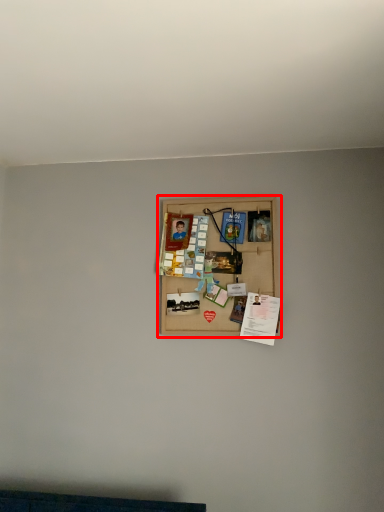
Question: From the image's perspective, where is picture frame (annotated by the red box) located relative to writing?

Choices:
 (A) below
 (B) above

Answer: (B)